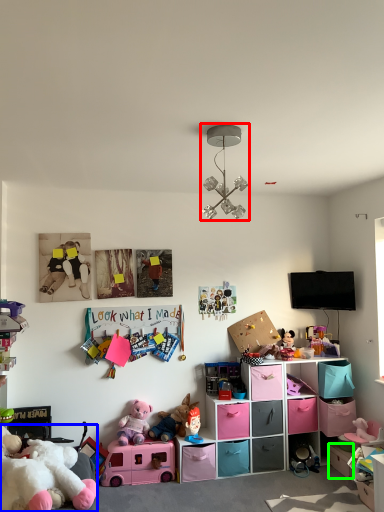
Question: Which object is the closest to the light fixture (highlighted by a red box)? Choose among these: toy (highlighted by a blue box) or storage box (highlighted by a green box).

Choices:
 (A) toy
 (B) storage box

Answer: (A)